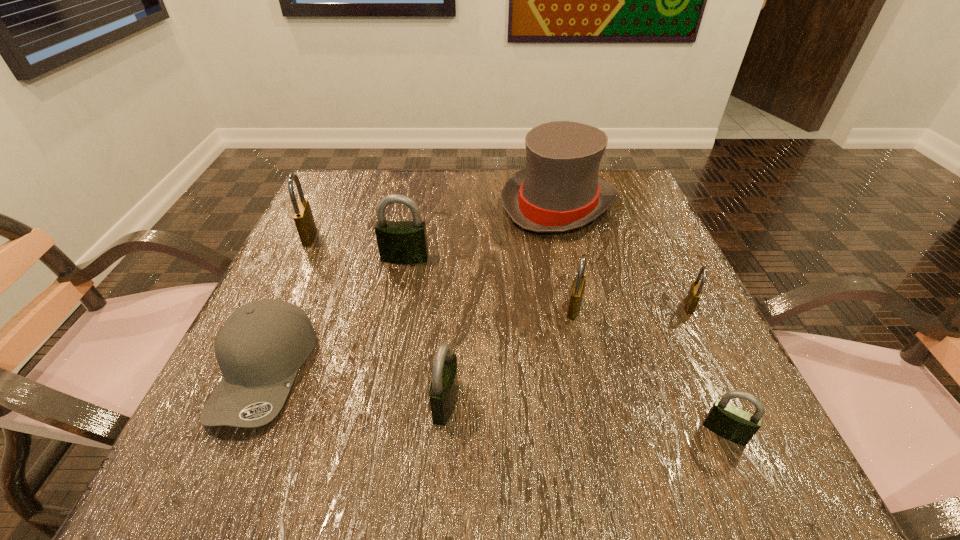
At what (x,y) coordinates should I click in order to perform the action: click on black padlock that is the closest to the gray baseball cap. Please return your answer as a coordinate pair (x, y). Looking at the image, I should click on (399, 242).

Identify the location of the third closest black padlock relative to the smallest brass padlock. (399, 242).

Where is `free space that satisfies the following two spatial constraints: 1. on the front brim of the gray baseball cap; 2. on the left side of the smallest black padlock`? The image size is (960, 540). free space that satisfies the following two spatial constraints: 1. on the front brim of the gray baseball cap; 2. on the left side of the smallest black padlock is located at coordinates (239, 431).

Identify the location of free space that satisfies the following two spatial constraints: 1. on the front side of the sixth object from right to left; 2. on the right side of the rightmost black padlock. The width and height of the screenshot is (960, 540). (371, 431).

Locate an element on the screen. blank space that satisfies the following two spatial constraints: 1. on the front side of the third padlock from right to left; 2. on the right side of the fifth nearest padlock is located at coordinates (395, 308).

The height and width of the screenshot is (540, 960). What are the coordinates of `blank space that satisfies the following two spatial constraints: 1. on the back side of the second biggest black padlock; 2. on the left side of the third padlock from right to left` in the screenshot? It's located at (452, 308).

What are the coordinates of `vacant space that satisfies the following two spatial constraints: 1. on the front side of the farthest black padlock; 2. on the left side of the second black padlock from right to left` in the screenshot? It's located at (376, 402).